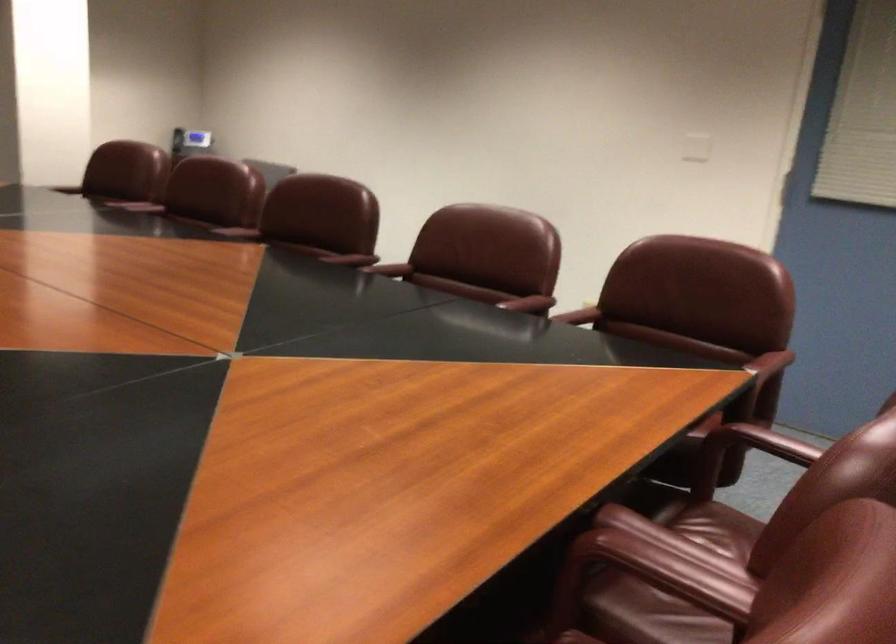
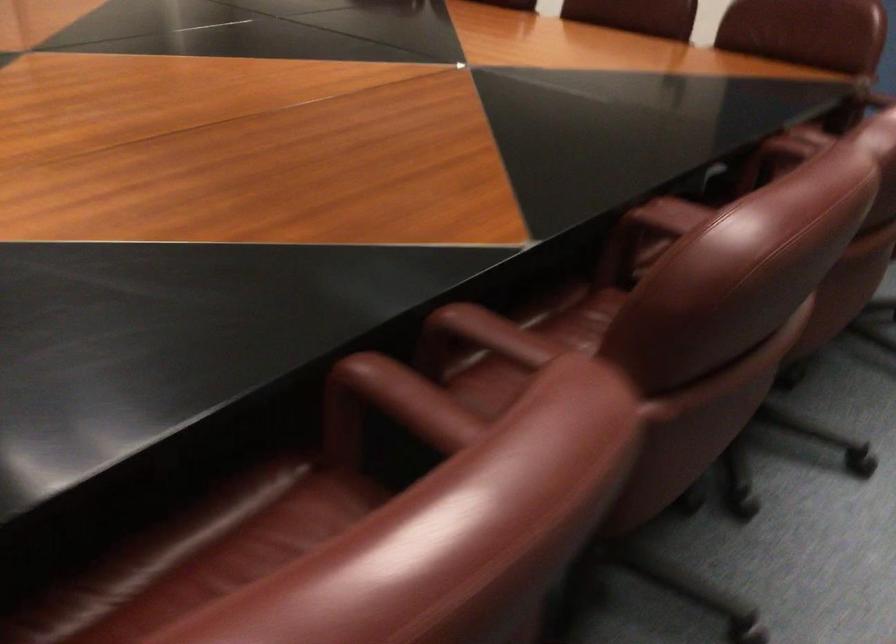
Where in the second image is the point corresponding to the point at 386,266 from the first image?

(392, 404)